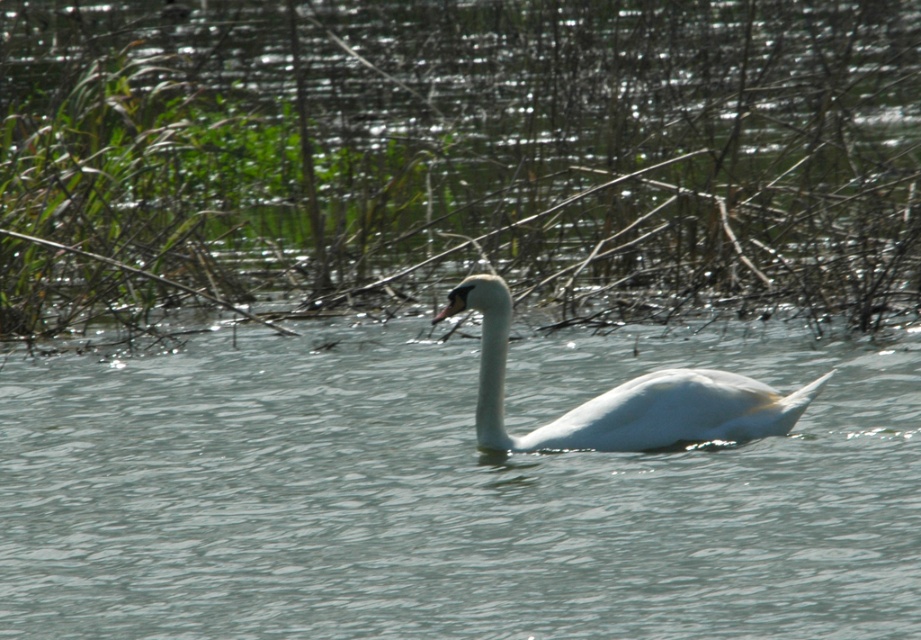
Question: Does clear water at center have a larger size compared to white glossy swan at center?

Choices:
 (A) no
 (B) yes

Answer: (B)

Question: Which object is farther from the camera taking this photo?

Choices:
 (A) white glossy swan at center
 (B) clear water at center

Answer: (A)

Question: Does clear water at center have a greater width compared to white glossy swan at center?

Choices:
 (A) no
 (B) yes

Answer: (B)

Question: Is clear water at center to the right of white glossy swan at center from the viewer's perspective?

Choices:
 (A) no
 (B) yes

Answer: (A)

Question: Among these objects, which one is nearest to the camera?

Choices:
 (A) white glossy swan at center
 (B) clear water at center

Answer: (B)